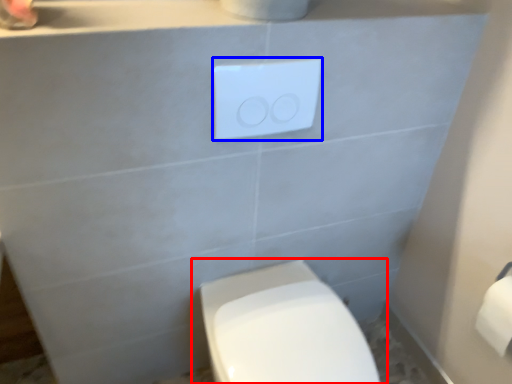
Question: Which object appears closest to the camera in this image, toilet (highlighted by a red box) or light switch (highlighted by a blue box)?

Choices:
 (A) toilet
 (B) light switch

Answer: (A)